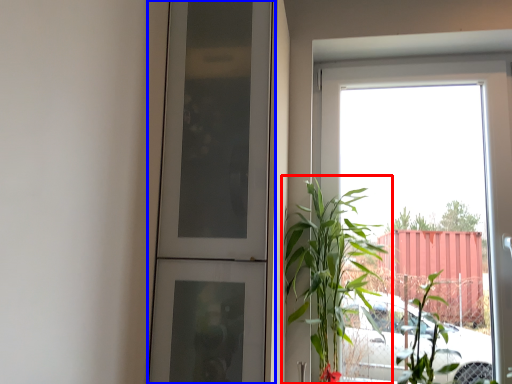
Question: Among these objects, which one is farthest to the camera, houseplant (highlighted by a red box) or door (highlighted by a blue box)?

Choices:
 (A) houseplant
 (B) door

Answer: (A)